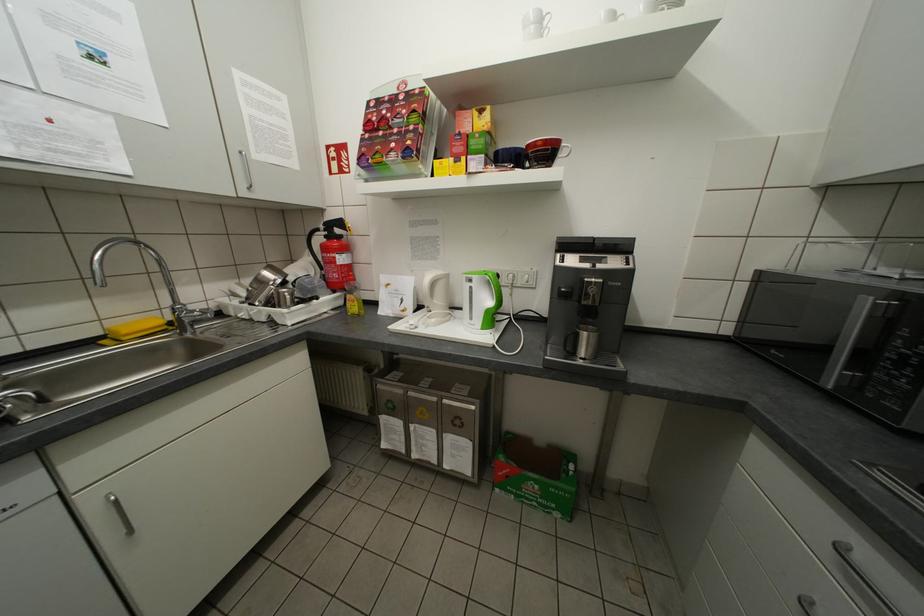
Where would you lift the green kettle handle? Please return your answer as a coordinate pair (x, y).

(500, 286)